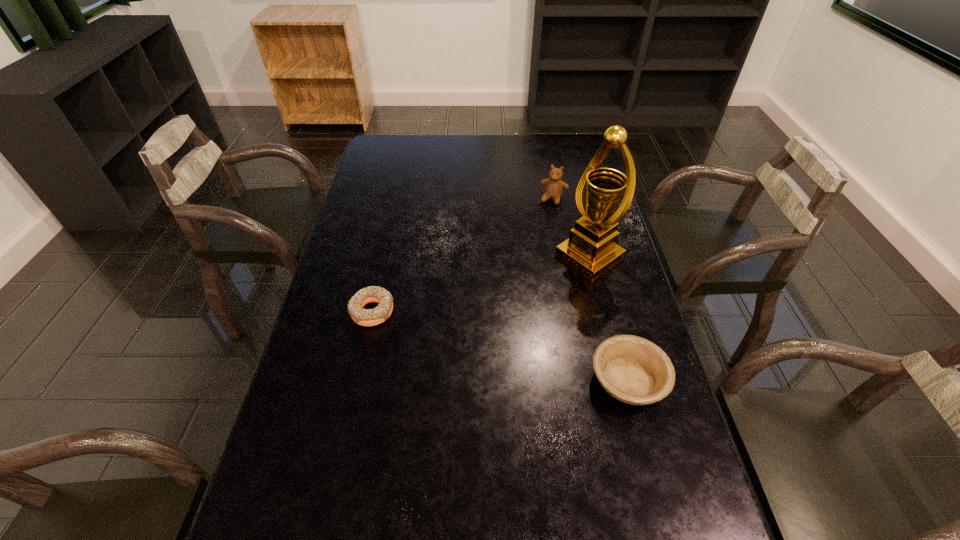
At what (x,y) coordinates should I click in order to perform the action: click on vacant area that lies between the doughnut and the nearest object. Please return your answer as a coordinate pair (x, y). The width and height of the screenshot is (960, 540). Looking at the image, I should click on (500, 346).

Where is `empty space between the teddy bear and the award`? empty space between the teddy bear and the award is located at coordinates (571, 227).

Where is `vacant area between the award and the teddy bear`? This screenshot has width=960, height=540. vacant area between the award and the teddy bear is located at coordinates (571, 227).

Locate an element on the screen. empty location between the second tallest object and the third farthest object is located at coordinates (463, 255).

Image resolution: width=960 pixels, height=540 pixels. Identify the location of free space between the leftmost object and the award. (481, 284).

Where is `vacant space in between the bowl and the tallest object`? The image size is (960, 540). vacant space in between the bowl and the tallest object is located at coordinates (609, 319).

Locate which object ranks second in proximity to the third farthest object. Please provide its 2D coordinates. Your answer should be formatted as a tuple, i.e. [(x, y)], where the tuple contains the x and y coordinates of a point satisfying the conditions above.

[(634, 370)]

Choose which object is the nearest neighbor to the tallest object. Please provide its 2D coordinates. Your answer should be formatted as a tuple, i.e. [(x, y)], where the tuple contains the x and y coordinates of a point satisfying the conditions above.

[(554, 186)]

This screenshot has width=960, height=540. What are the coordinates of `vacant area that satisfies the following two spatial constraints: 1. on the front side of the third nearest object; 2. on the right side of the second shortest object` in the screenshot? It's located at (620, 380).

The image size is (960, 540). Identify the location of vacant region that satisfies the following two spatial constraints: 1. on the front side of the teddy bear; 2. on the right side of the award. (564, 256).